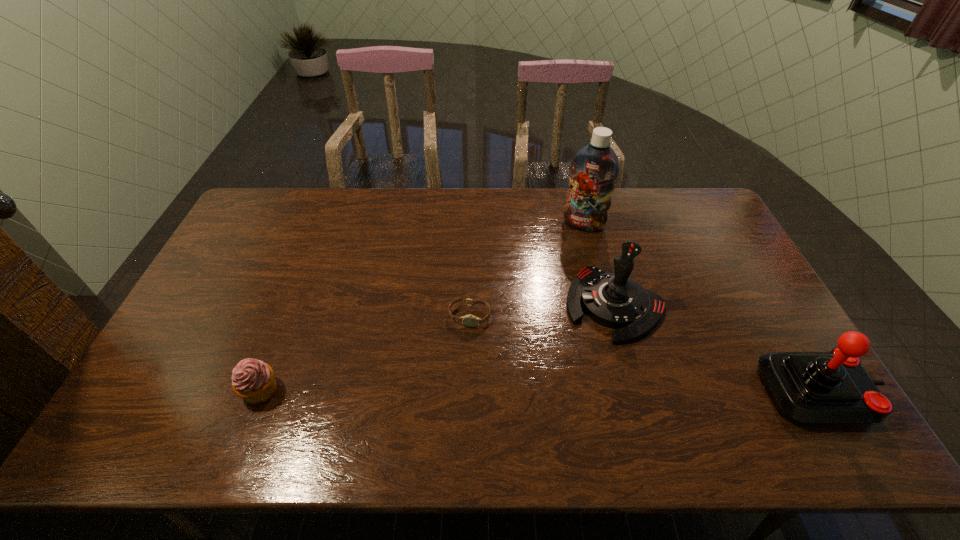
Identify which object is the second closest to the farther joystick. Please provide its 2D coordinates. Your answer should be formatted as a tuple, i.e. [(x, y)], where the tuple contains the x and y coordinates of a point satisfying the conditions above.

[(594, 168)]

Locate an element on the screen. This screenshot has height=540, width=960. object that is the closest to the cupcake is located at coordinates (469, 320).

Locate an element on the screen. This screenshot has width=960, height=540. vacant space that satisfies the following two spatial constraints: 1. on the front side of the farthest object; 2. on the base of the rightmost object is located at coordinates (626, 392).

I want to click on blank space that satisfies the following two spatial constraints: 1. on the front side of the rightmost object; 2. on the base of the watch, so click(x=468, y=392).